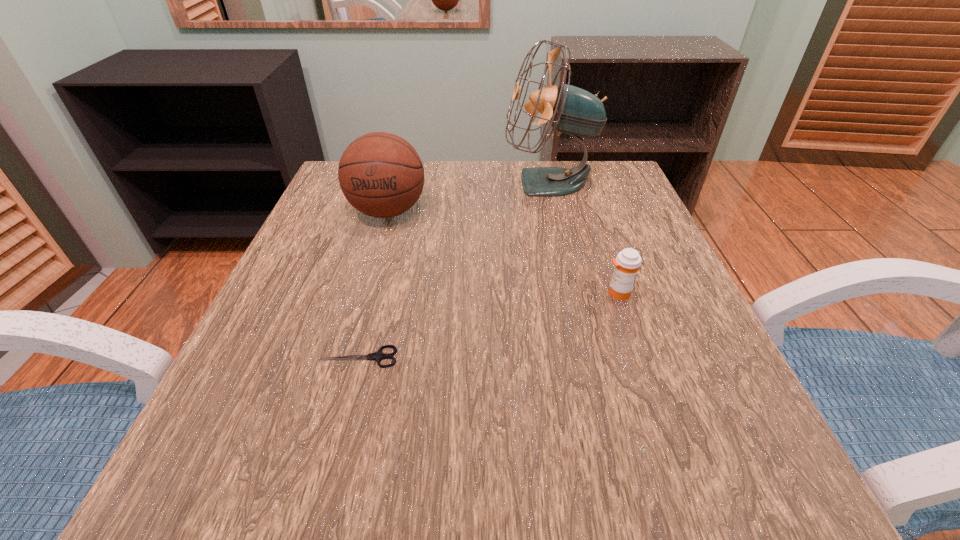
This screenshot has width=960, height=540. What are the coordinates of `vacant area that satisfies the following two spatial constraints: 1. on the side with brand label of the basketball; 2. on the left side of the shears` in the screenshot? It's located at (346, 357).

Where is `free space that satisfies the following two spatial constraints: 1. on the front-facing side of the tallest object for air flow; 2. on the side with brand label of the basketball`? The image size is (960, 540). free space that satisfies the following two spatial constraints: 1. on the front-facing side of the tallest object for air flow; 2. on the side with brand label of the basketball is located at coordinates (556, 212).

Image resolution: width=960 pixels, height=540 pixels. What are the coordinates of `free space that satisfies the following two spatial constraints: 1. on the side with brand label of the shears; 2. on the right side of the second tallest object` in the screenshot? It's located at (346, 357).

Identify the location of vacant region that satisfies the following two spatial constraints: 1. on the front-facing side of the second shortest object for air flow; 2. on the right side of the tallest object. This screenshot has height=540, width=960. (575, 293).

This screenshot has height=540, width=960. I want to click on vacant space that satisfies the following two spatial constraints: 1. on the front-facing side of the fan for air flow; 2. on the right side of the medicine, so click(x=575, y=293).